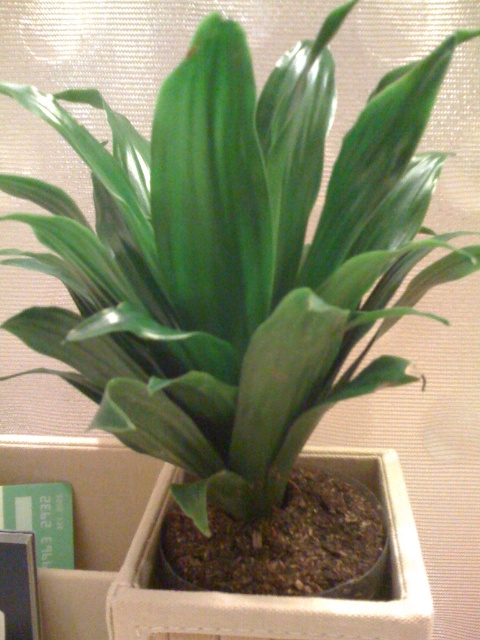
Which is more to the left, matte white pot at center or green cardboard box at lower left?

Positioned to the left is green cardboard box at lower left.

The width and height of the screenshot is (480, 640). I want to click on matte white pot at center, so click(x=282, y=596).

Where is `matte white pot at center`? The width and height of the screenshot is (480, 640). matte white pot at center is located at coordinates (282, 596).